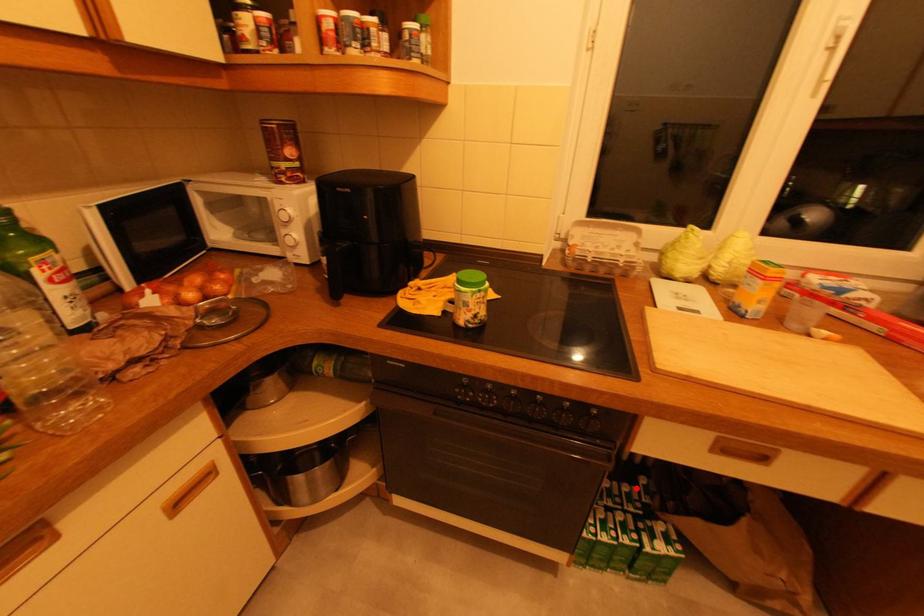
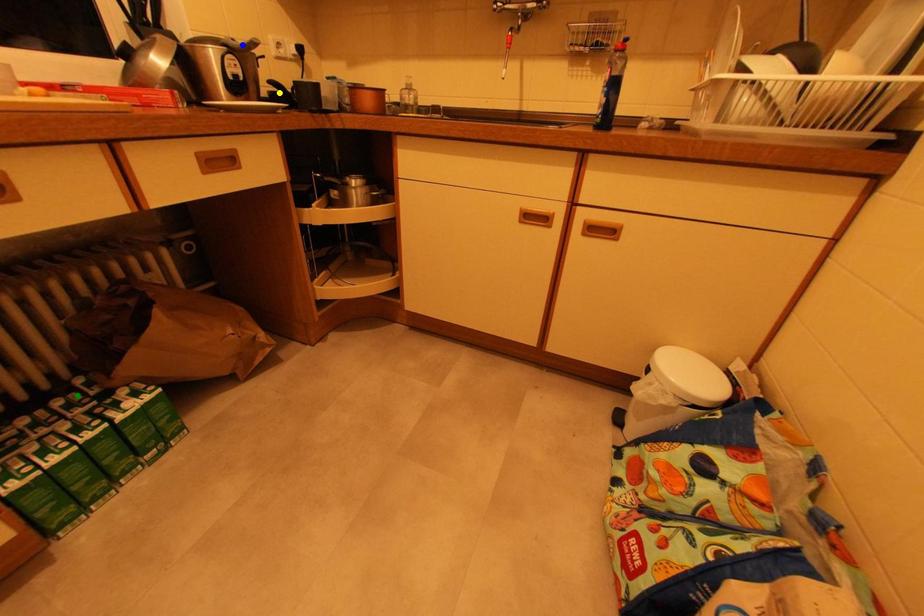
Question: I am providing you with two images of the same scene from different viewpoints. A red point is marked on the first image. You are given multiple points on the second image. Which point in image 2 is actually the same real-world point as the red point in image 1?

Choices:
 (A) yellow point
 (B) blue point
 (C) green point

Answer: (C)